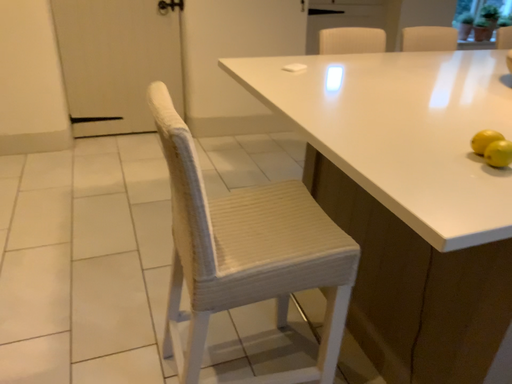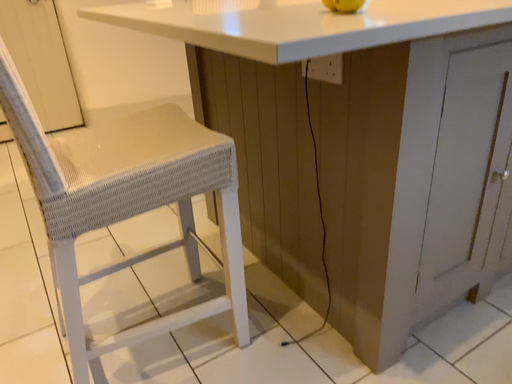
Question: How did the camera likely rotate when shooting the video?

Choices:
 (A) rotated left
 (B) rotated right

Answer: (B)